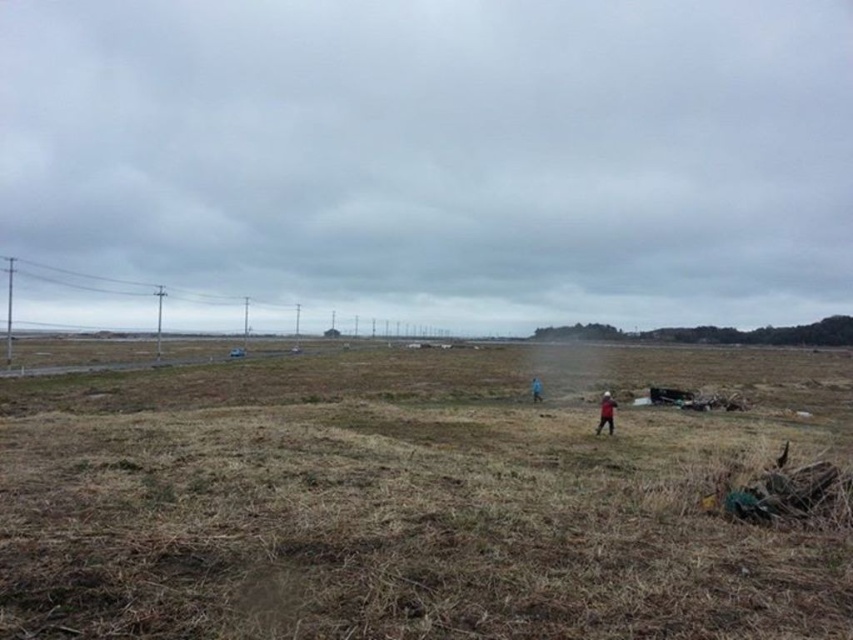
Question: Is dark red fabric at center smaller than blue fabric person at center?

Choices:
 (A) yes
 (B) no

Answer: (A)

Question: Which point appears closest to the camera in this image?

Choices:
 (A) (532, 380)
 (B) (804, 404)

Answer: (B)

Question: Does brown grassy field at center have a greater width compared to blue fabric person at center?

Choices:
 (A) no
 (B) yes

Answer: (B)

Question: Which object is closer to the camera taking this photo?

Choices:
 (A) brown grassy field at center
 (B) dark red fabric at center
 (C) blue fabric person at center

Answer: (A)

Question: Can you confirm if dark red fabric at center is wider than blue fabric person at center?

Choices:
 (A) no
 (B) yes

Answer: (A)

Question: Among these points, which one is nearest to the camera?

Choices:
 (A) (656, 557)
 (B) (604, 417)

Answer: (A)